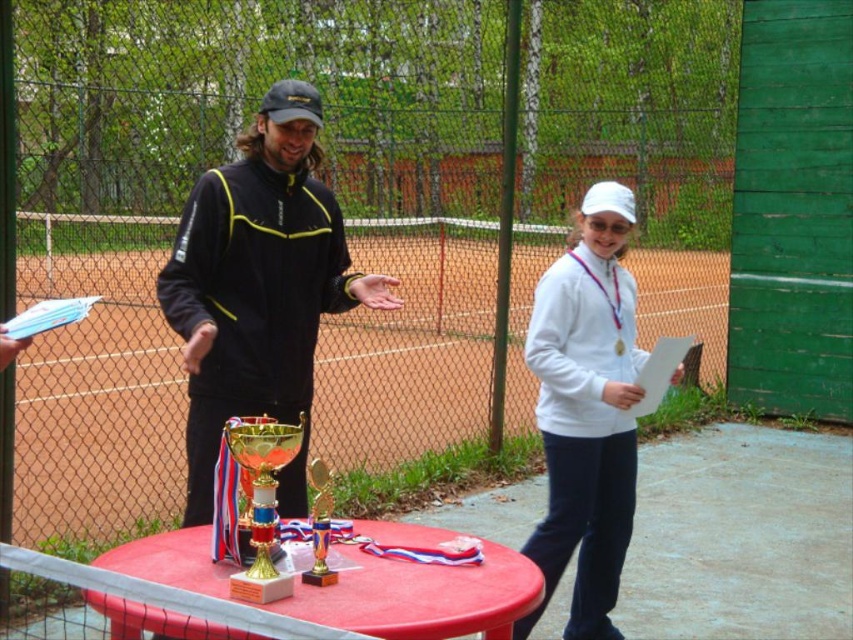
You are an athlete getting ready for a match and see the black softshell jacket at center and the white matte jacket at center on the table. Which jacket is on top of the other?

The black softshell jacket at center is located above the white matte jacket at center, so the black jacket is on top.

Based on the photo, you are a photographer at a tennis tournament. You need to take a photo of the white matte jacket at center and the gold metallic trophy at center. Which object should you focus on first if you want to capture the larger item in the frame?

The white matte jacket at center is bigger than the gold metallic trophy at center, so you should focus on the white matte jacket at center first to capture the larger item in the frame.

In the scene shown: You are organizing a tennis event and need to decide which jacket to place on the table between the trophies. The black softshell jacket at center and the white matte jacket at center are both available. Which jacket takes up more space on the table?

The black softshell jacket at center is bigger than the white matte jacket at center, so it takes up more space on the table.